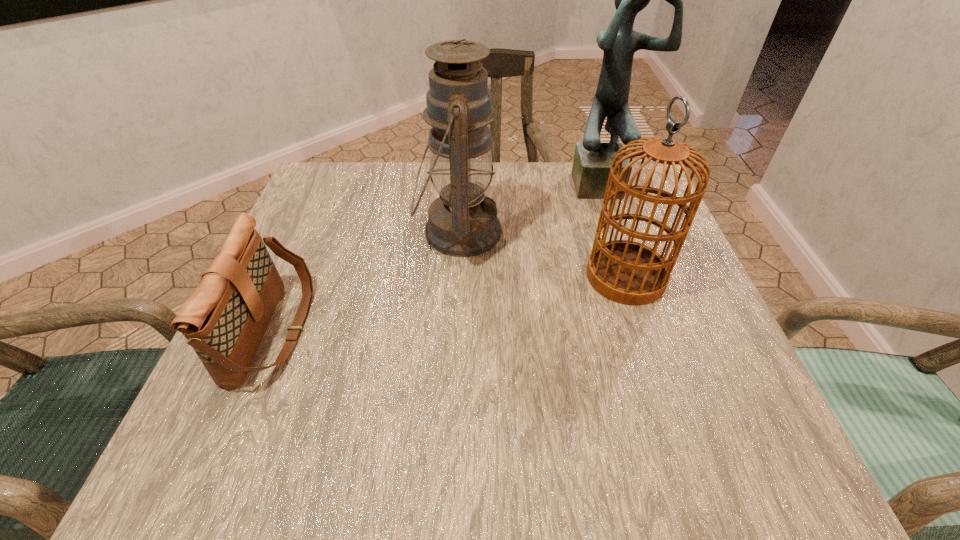
At what (x,y) coordinates should I click in order to perform the action: click on sculpture. Please return your answer as a coordinate pair (x, y). Looking at the image, I should click on (592, 161).

Where is `the second object from left to right`? the second object from left to right is located at coordinates (463, 222).

Where is `birdcage`? birdcage is located at coordinates (627, 272).

Locate an element on the screen. The height and width of the screenshot is (540, 960). shoulder bag is located at coordinates (224, 319).

The width and height of the screenshot is (960, 540). In order to click on the leftmost object in this screenshot , I will do `click(224, 319)`.

The image size is (960, 540). What are the coordinates of `vacant space situated 0.170m on the face of the sculpture` in the screenshot? It's located at (625, 249).

This screenshot has width=960, height=540. What are the coordinates of `vacant space located 0.170m on the front of the oil lamp` in the screenshot? It's located at point(453,343).

I want to click on free location located 0.250m on the left of the birdcage, so click(x=457, y=276).

Find the location of a particular element. vacant space located on the front-facing side of the leftmost object is located at coordinates (449, 330).

Image resolution: width=960 pixels, height=540 pixels. What are the coordinates of `sculpture at the far edge` in the screenshot? It's located at (592, 161).